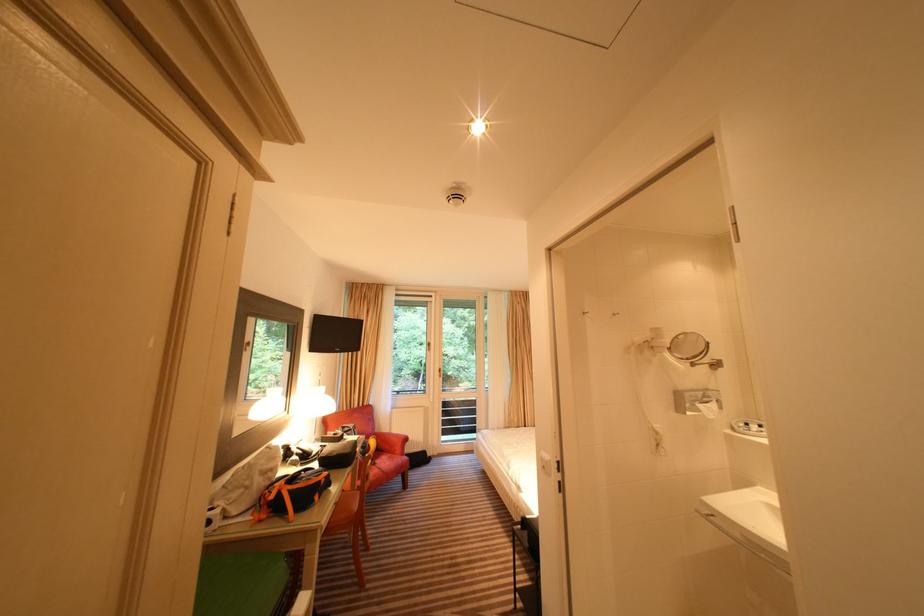
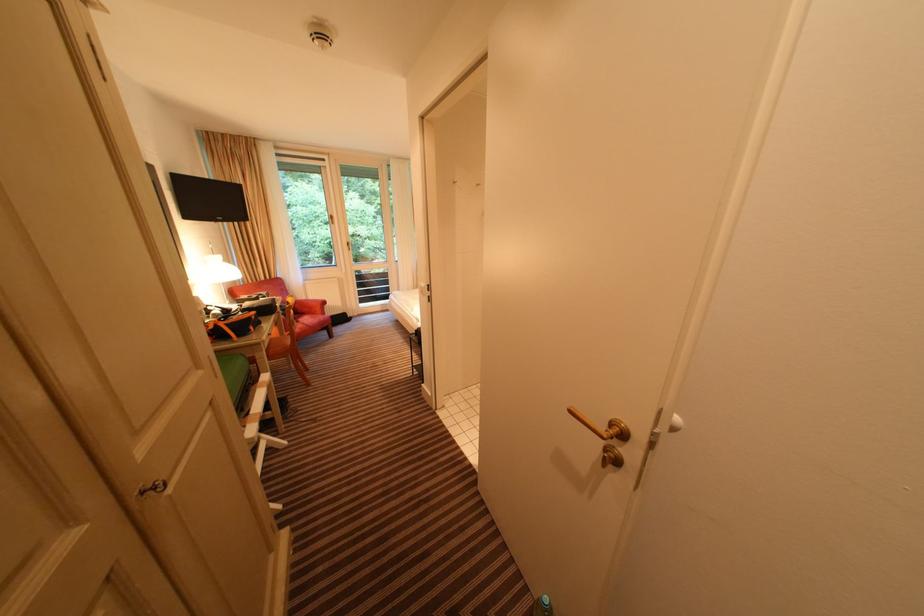
How did the camera likely rotate?

The rotation direction of the camera is right-down.